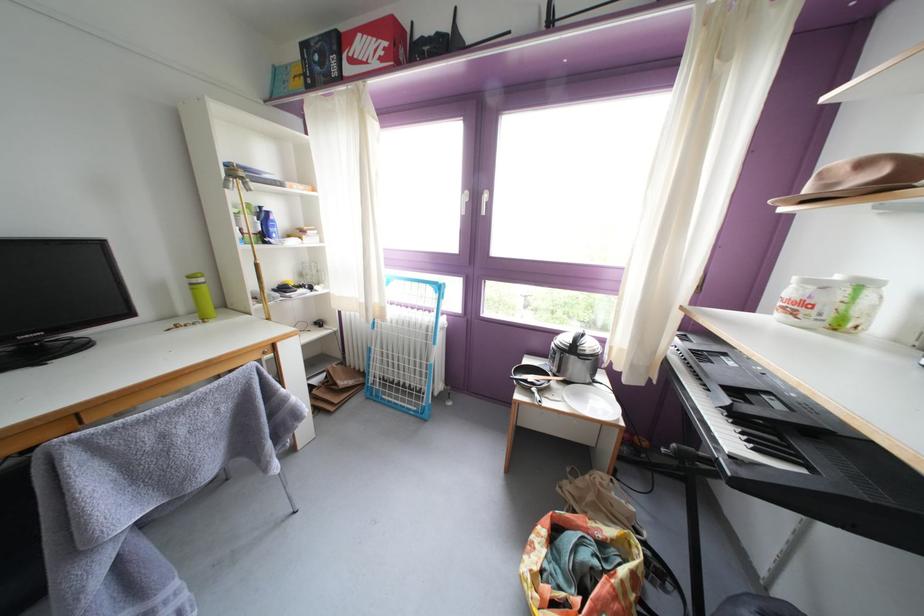
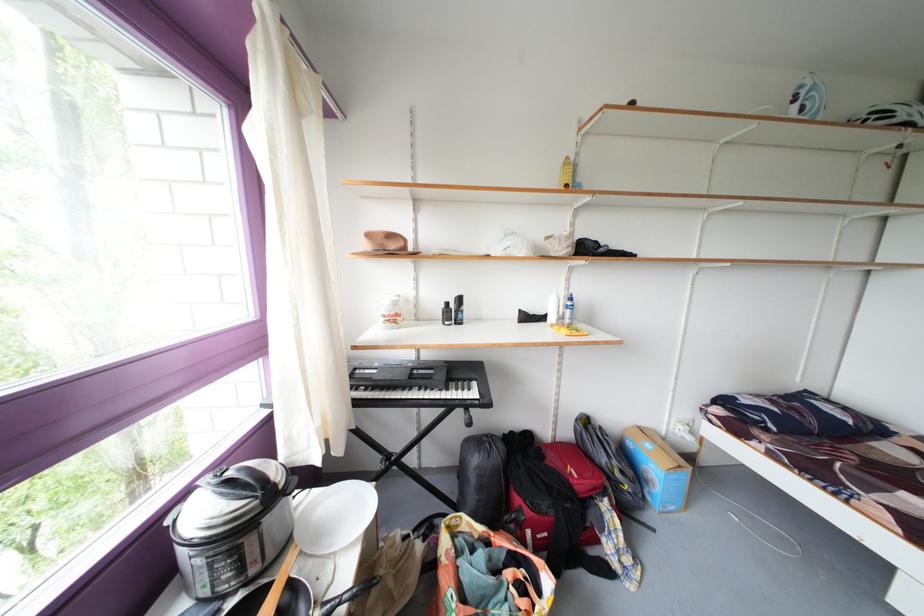
The images are taken continuously from a first-person perspective. In which direction is your viewpoint rotating?

The rotation direction of the camera is right-down.